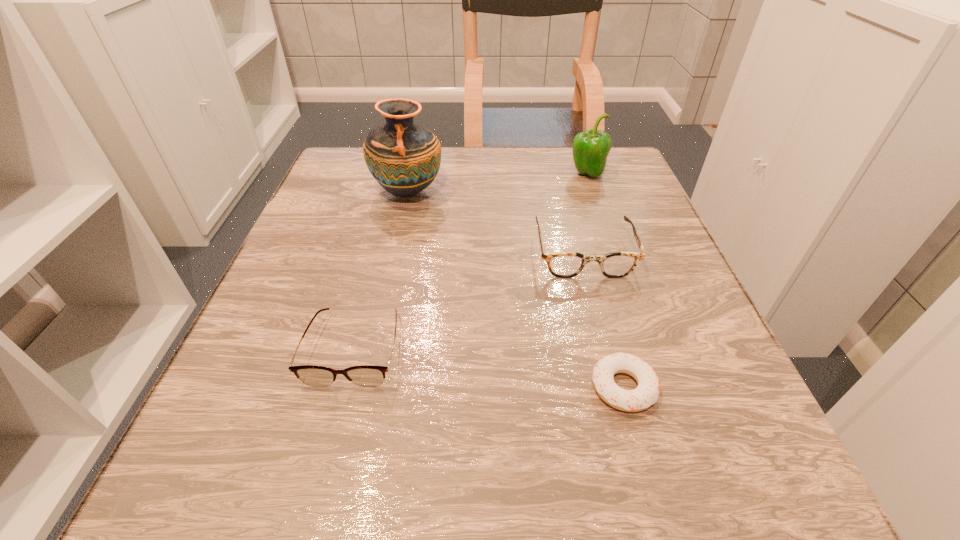
Where is `vacant area situated on the face of the shorter spectacles`? vacant area situated on the face of the shorter spectacles is located at coordinates (331, 436).

The height and width of the screenshot is (540, 960). In order to click on free space located 0.090m on the left of the shortest object in this screenshot , I will do `click(524, 387)`.

Where is `pottery that is at the far edge`? pottery that is at the far edge is located at coordinates (404, 158).

You are a GUI agent. You are given a task and a screenshot of the screen. Output one action in this format:
    pyautogui.click(x=<x>, y=<y>)
    Task: Click on the bell pepper located at the far edge
    This screenshot has height=540, width=960.
    Given the screenshot: What is the action you would take?
    pyautogui.click(x=590, y=148)

You are a GUI agent. You are given a task and a screenshot of the screen. Output one action in this format:
    pyautogui.click(x=<x>, y=<y>)
    Task: Click on the pottery that is at the left edge
    
    Given the screenshot: What is the action you would take?
    pyautogui.click(x=404, y=158)

At what (x,y) coordinates should I click in order to perform the action: click on spectacles that is at the left edge. Please return your answer as a coordinate pair (x, y). This screenshot has width=960, height=540. Looking at the image, I should click on (364, 375).

Identify the location of bell pepper that is at the right edge. This screenshot has height=540, width=960. click(x=590, y=148).

I want to click on spectacles that is at the right edge, so (563, 264).

This screenshot has width=960, height=540. I want to click on doughnut that is at the right edge, so click(647, 392).

Locate an element on the screen. The width and height of the screenshot is (960, 540). object located at the far left corner is located at coordinates (404, 158).